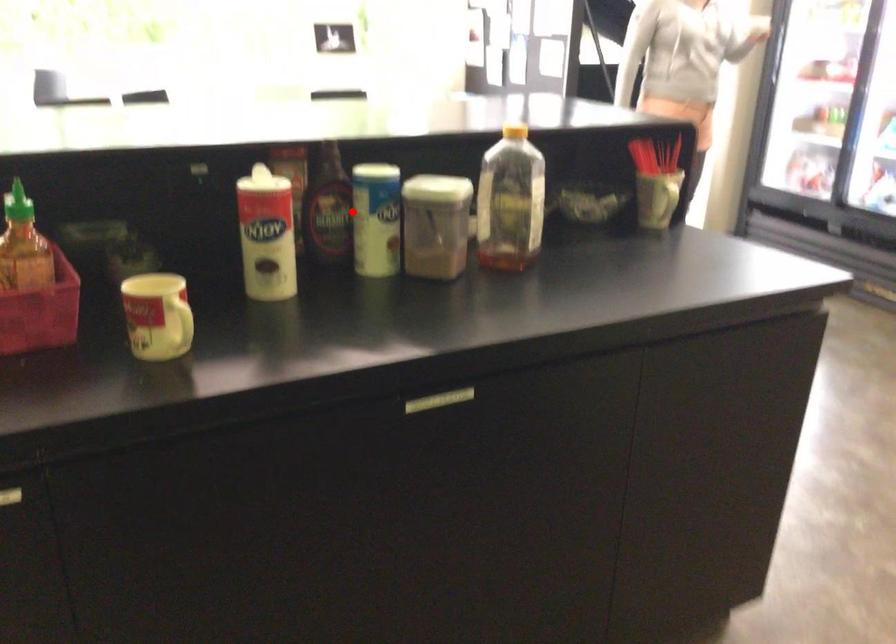
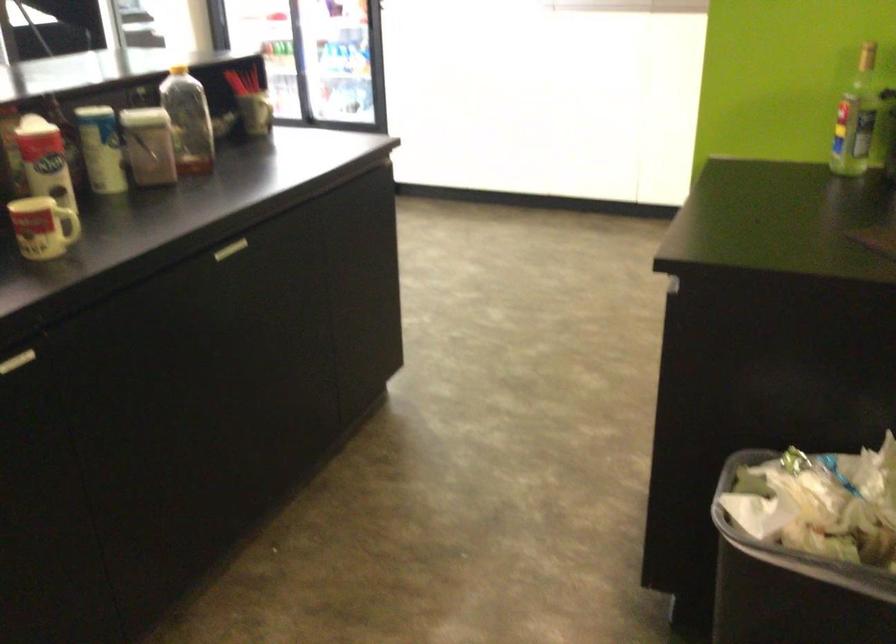
Question: I am providing you with two images of the same scene from different viewpoints. In image1, a red point is highlighted. Considering the same 3D point in image2, which of the following is correct?

Choices:
 (A) It is closer
 (B) It is farther

Answer: (B)